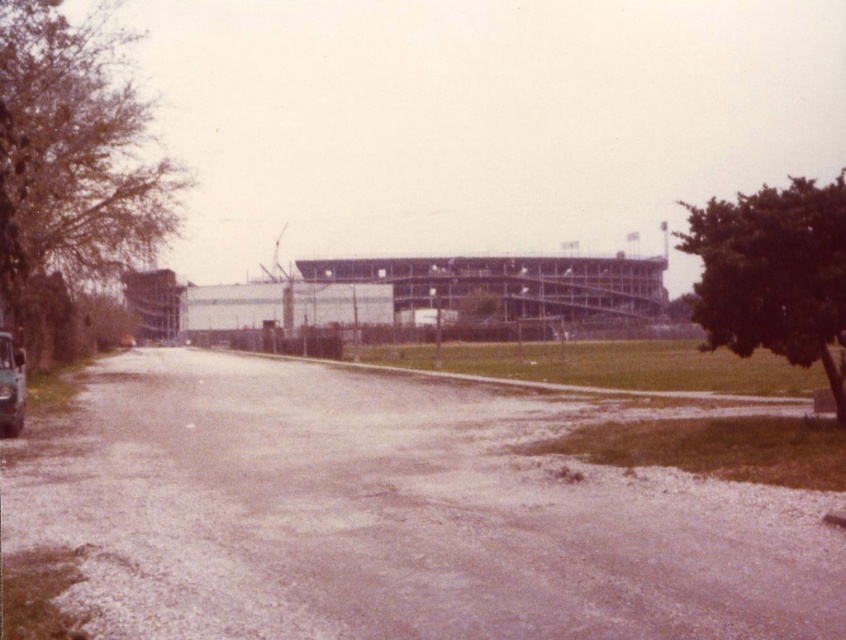
Question: Which point is closer to the camera taking this photo?

Choices:
 (A) (26, 234)
 (B) (548, 624)
 (C) (476, 307)
 (D) (11, 403)

Answer: (B)

Question: Which of these objects is positioned closest to the green leafy tree at center?

Choices:
 (A) brown gravel road at center
 (B) shiny metallic car at left

Answer: (A)

Question: Is brown gravel road at center further to the viewer compared to green leafy tree at left?

Choices:
 (A) no
 (B) yes

Answer: (A)

Question: Is green leafy tree at right closer to camera compared to shiny metallic car at left?

Choices:
 (A) no
 (B) yes

Answer: (B)

Question: In this image, where is green leafy tree at left located relative to green leafy tree at center?

Choices:
 (A) left
 (B) right

Answer: (A)

Question: Based on their relative distances, which object is farther from the green leafy tree at center?

Choices:
 (A) shiny metallic car at left
 (B) green leafy tree at right
 (C) green leafy tree at left

Answer: (B)